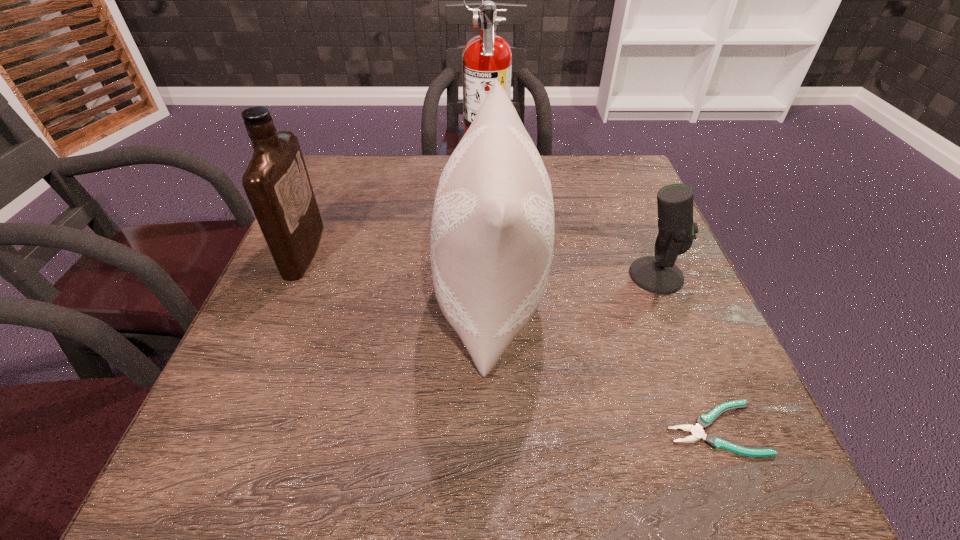
Find the location of `the tallest object`. the tallest object is located at coordinates (487, 57).

Where is `fire extinguisher`? The width and height of the screenshot is (960, 540). fire extinguisher is located at coordinates (487, 57).

This screenshot has width=960, height=540. I want to click on cushion, so click(492, 233).

This screenshot has height=540, width=960. I want to click on the leftmost object, so click(276, 181).

You are a GUI agent. You are given a task and a screenshot of the screen. Output one action in this format:
    pyautogui.click(x=<x>, y=<y>)
    Task: Click on the second shortest object
    
    Given the screenshot: What is the action you would take?
    [658, 274]

At what (x,y) coordinates should I click in order to perform the action: click on pliers. Please return your answer as a coordinate pair (x, y). Looking at the image, I should click on (704, 421).

The height and width of the screenshot is (540, 960). Identify the location of the nearest object. (704, 421).

Identify the location of free point located 0.350m on the nozzle side of the fire extinguisher. The width and height of the screenshot is (960, 540). (338, 174).

The image size is (960, 540). In order to click on free space located on the nozzle side of the fire extinguisher in this screenshot , I will do `click(348, 174)`.

Identify the location of vacant region located on the nozzle side of the fire extinguisher. The image size is (960, 540). (440, 174).